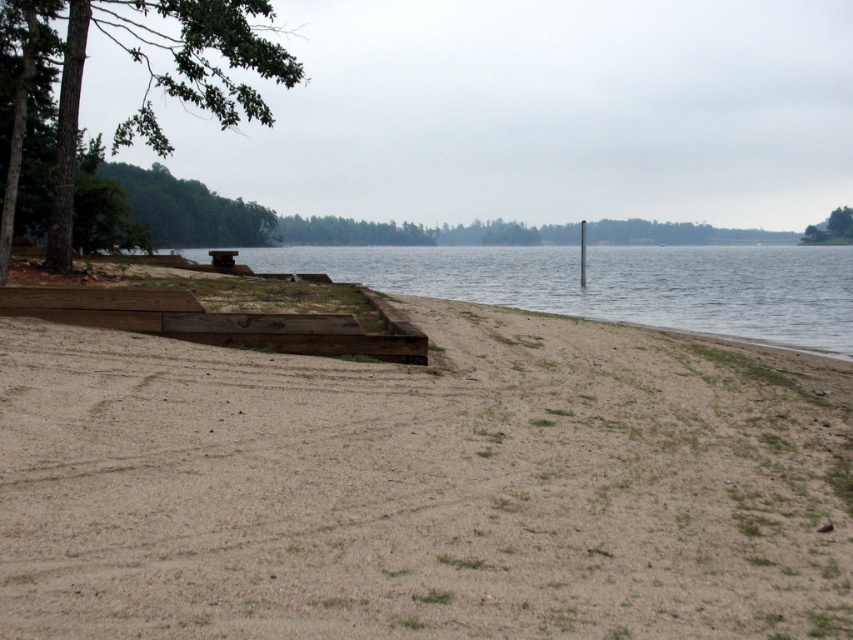
Question: In this image, where is clear water at center located relative to green leafy tree at upper right?

Choices:
 (A) left
 (B) right

Answer: (A)

Question: Is brown sandy beach at lower left bigger than green leafy tree at upper right?

Choices:
 (A) no
 (B) yes

Answer: (B)

Question: Which of the following is the closest to the observer?

Choices:
 (A) green leafy tree at upper right
 (B) brown sandy beach at lower left
 (C) smooth gray pole at right
 (D) green wood tree at upper left

Answer: (B)

Question: Does clear water at center have a lesser width compared to green wood tree at upper left?

Choices:
 (A) yes
 (B) no

Answer: (B)

Question: Which of the following is the closest to the observer?

Choices:
 (A) clear water at center
 (B) green leafy tree at upper right
 (C) green wood tree at upper left

Answer: (C)

Question: Which point is farther from the camera taking this photo?

Choices:
 (A) (711, 284)
 (B) (581, 257)
 (C) (74, 38)
 (D) (817, 234)

Answer: (D)